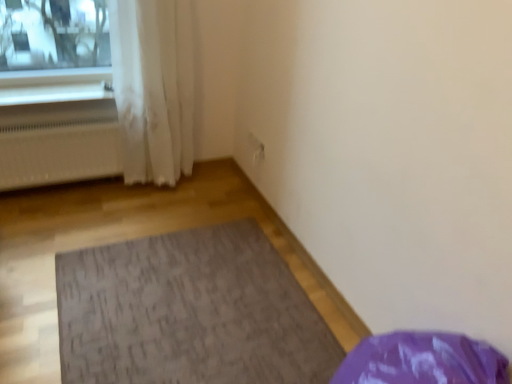
Where is `blank space above white plastic window sill at upper left (from a real-world perspective)`? Image resolution: width=512 pixels, height=384 pixels. blank space above white plastic window sill at upper left (from a real-world perspective) is located at coordinates (52, 87).